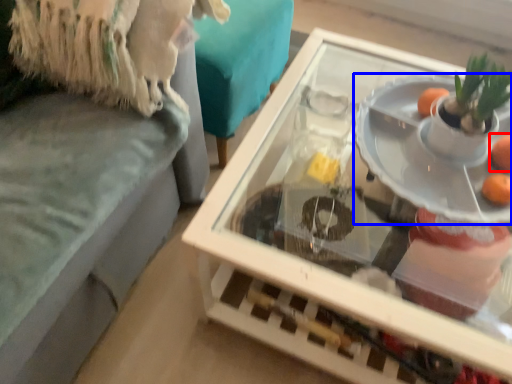
Question: Among these objects, which one is farthest to the camera, orange (highlighted by a red box) or plate (highlighted by a blue box)?

Choices:
 (A) orange
 (B) plate

Answer: (A)